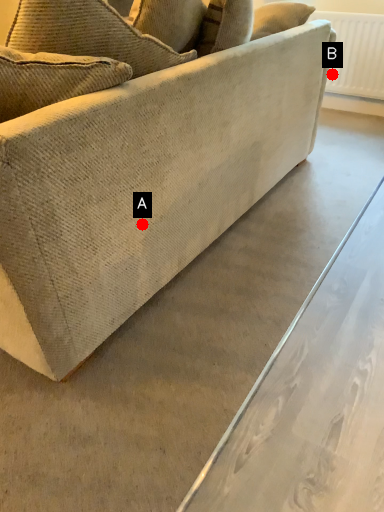
Question: Two points are circled on the image, labeled by A and B beside each circle. Which point is further to the camera?

Choices:
 (A) A is further
 (B) B is further

Answer: (B)